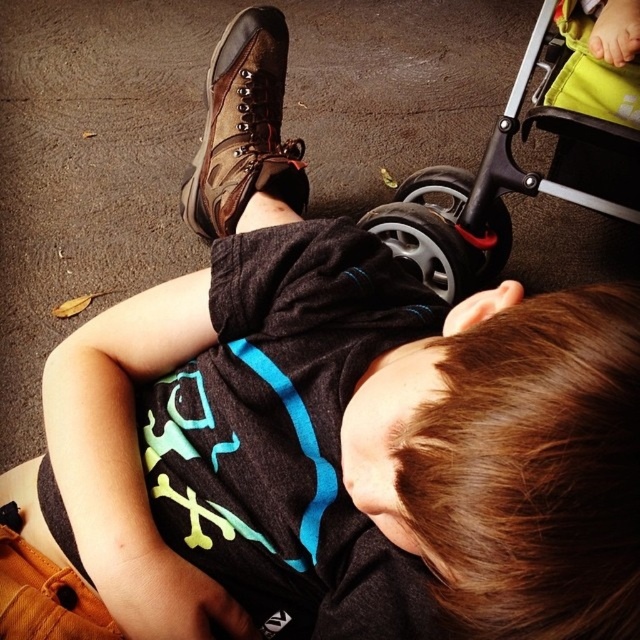
You are a parent trying to locate your stroller in a crowded park. You remember that the stroller is positioned at point (493, 182) in the image. Based on the coordinates provided, where should you look to find the black rubber baby carriage?

The coordinates point (493, 182) indicate the location of the black rubber baby carriage at lower right, so you should look towards the lower right area of the image.

You are a parent trying to retrieve your child from the ground. The black rubber baby carriage at lower right is in your way. Can you move the carriage to the side to reach your child?

The black rubber baby carriage at lower right is located at point (493, 182), which means it is positioned to the lower right of the frame. Since the child is lying on the ground in the center, you can move the carriage to the side to reach your child.

You are a parent carrying a baby and need to place the baby in the stroller. The baby is currently near the brown leather boot at upper center. Can you reach the black rubber baby carriage at lower right without moving your feet?

The distance between the brown leather boot at upper center and the black rubber baby carriage at lower right is 11.71 inches, so you can easily reach the black rubber baby carriage at lower right without moving your feet since the distance is very short.